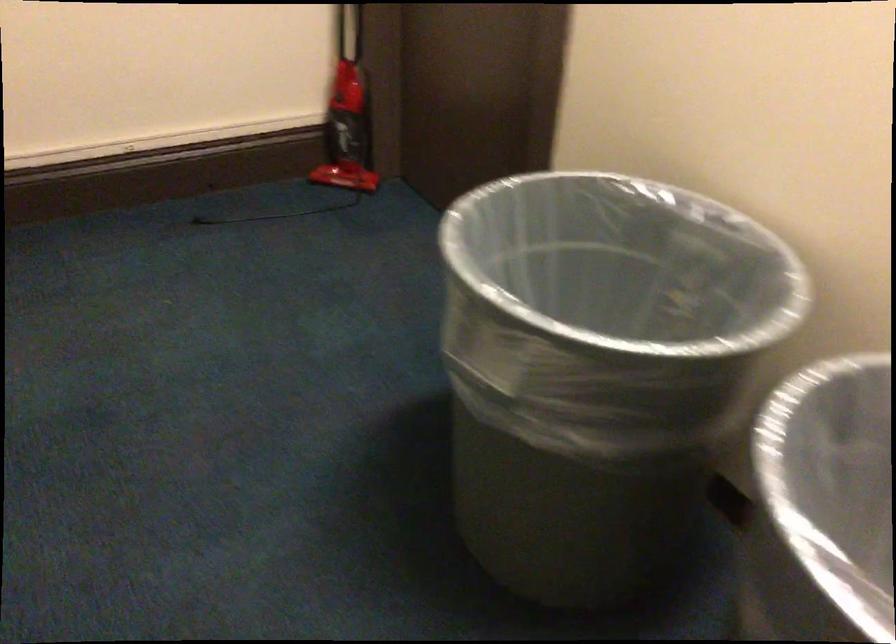
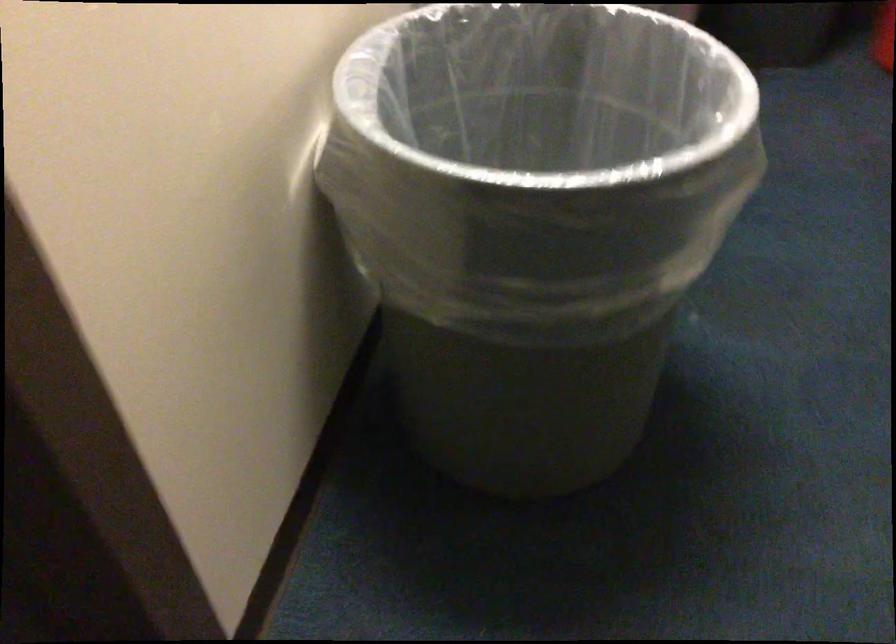
In the second image, find the point that corresponds to (705,438) in the first image.

(538, 136)